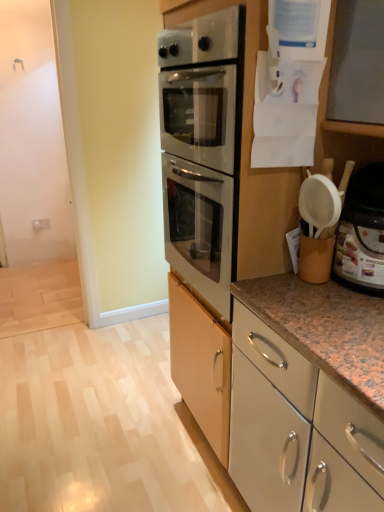
Find the location of `empty space that is ontop of white glossy cabinet at lower right, the 1th cabinetry in the bottom-to-top sequence (from a real-world perspective)`. empty space that is ontop of white glossy cabinet at lower right, the 1th cabinetry in the bottom-to-top sequence (from a real-world perspective) is located at coordinates [117, 418].